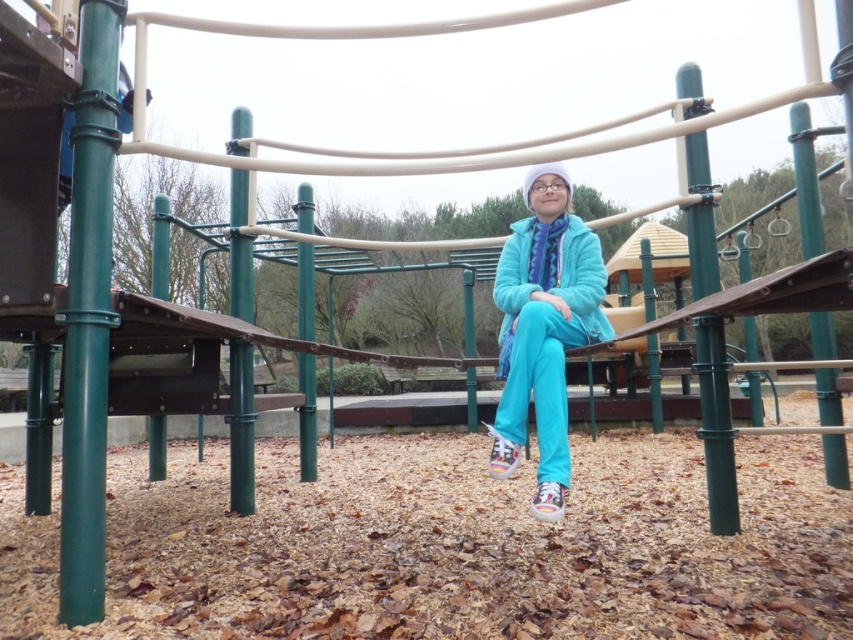
Is turquoise fabric jacket at center positioned behind matte blue jacket at center?

No, turquoise fabric jacket at center is in front of matte blue jacket at center.

Does turquoise fabric jacket at center appear on the left side of matte blue jacket at center?

Incorrect, turquoise fabric jacket at center is not on the left side of matte blue jacket at center.

Is point (534, 362) behind point (558, 237)?

No, it is in front of (558, 237).

The height and width of the screenshot is (640, 853). Identify the location of turquoise fabric jacket at center. (543, 328).